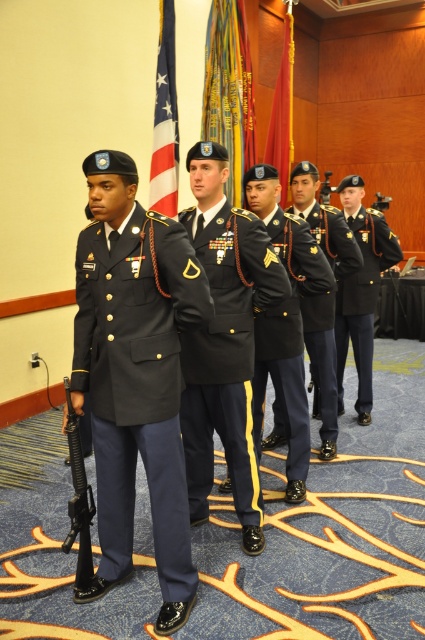
You are a military photographer preparing to take a group photo of the navy blue fabric uniform at left and the black matte uniform at right. Based on their positions in the image, which uniform is positioned lower in the frame?

The navy blue fabric uniform at left is positioned lower in the frame since it is described as being below the black matte uniform at right.

You are a photographer standing in front of the black matte uniform at center during a military ceremony. You want to take a closeup shot of the medals on the uniform. Considering the distance between you and the uniform, is it feasible to capture clear details of the medals without moving closer?

The distance between you and the black matte uniform at center is 7.77 feet. Since this distance is relatively close, it should be feasible to capture clear details of the medals using a zoom lens or a camera with high resolution. Moving closer might not be necessary unless extremely fine details are required.